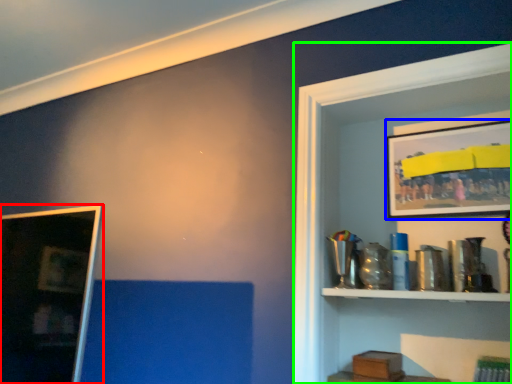
Question: Estimate the real-world distances between objects in this image. Which object is farther from picture frame (highlighted by a red box), picture frame (highlighted by a blue box) or shelf (highlighted by a green box)?

Choices:
 (A) picture frame
 (B) shelf

Answer: (A)